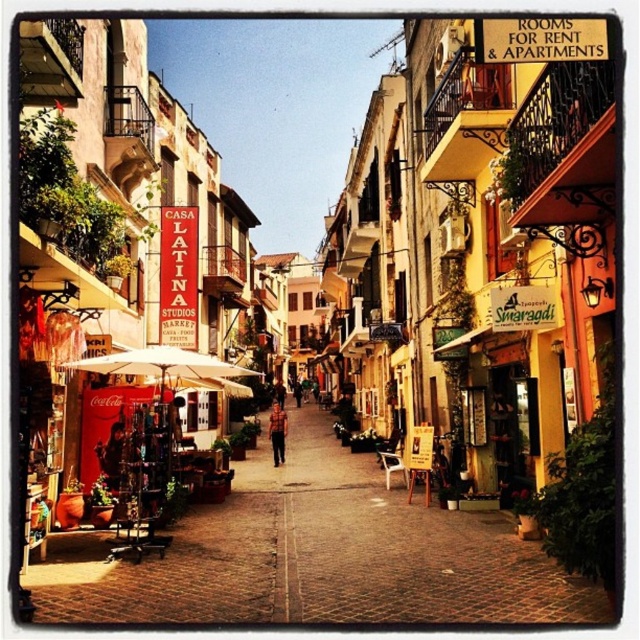
Question: Which of the following is the closest to the observer?

Choices:
 (A) (172, 397)
 (B) (285, 429)
 (C) (232, 576)
 (D) (257, 376)

Answer: (C)

Question: In this image, where is brown plaid shirt at center located relative to brown leather bag at center?

Choices:
 (A) below
 (B) above

Answer: (A)

Question: Among these objects, which one is nearest to the camera?

Choices:
 (A) matte red coca-cola sign at center
 (B) white fabric umbrella at center
 (C) brown leather bag at center

Answer: (A)

Question: Can you confirm if matte red coca-cola sign at center is positioned to the right of brown plaid shirt at center?

Choices:
 (A) no
 (B) yes

Answer: (B)

Question: Which point is farther to the camera?

Choices:
 (A) (170, 374)
 (B) (333, 616)

Answer: (A)

Question: In this image, where is white fabric umbrella at center located relative to brown plaid shirt at center?

Choices:
 (A) right
 (B) left

Answer: (B)